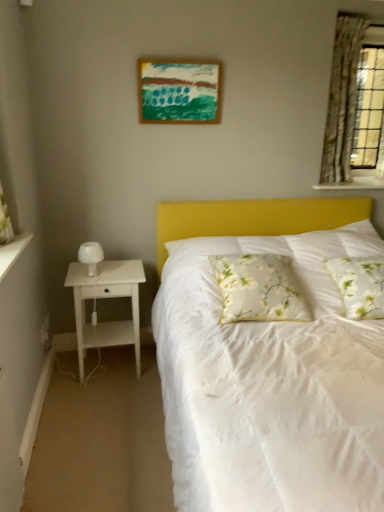
The image size is (384, 512). In order to click on blank space to the left of white matte table lamp at left in this screenshot , I will do tap(81, 271).